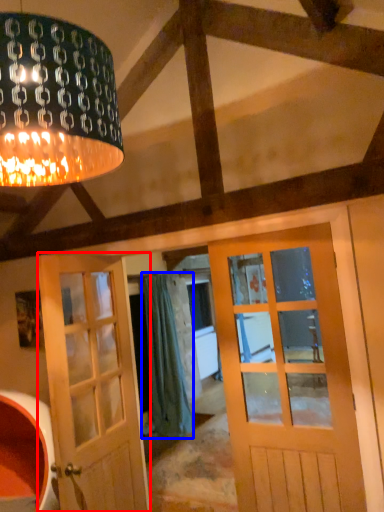
Question: Among these objects, which one is nearest to the camera, door (highlighted by a red box) or curtain (highlighted by a blue box)?

Choices:
 (A) door
 (B) curtain

Answer: (A)